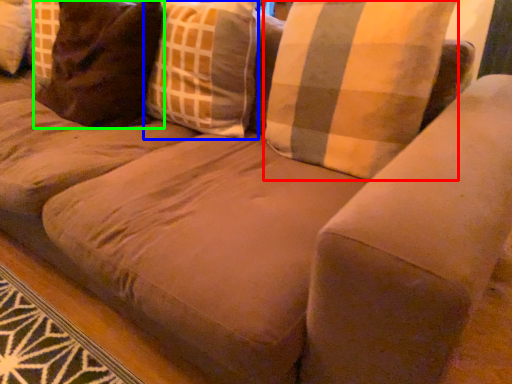
Question: Estimate the real-world distances between objects in this image. Which object is farther from pillow (highlighted by a red box), throw pillow (highlighted by a blue box) or pillow (highlighted by a green box)?

Choices:
 (A) throw pillow
 (B) pillow

Answer: (B)